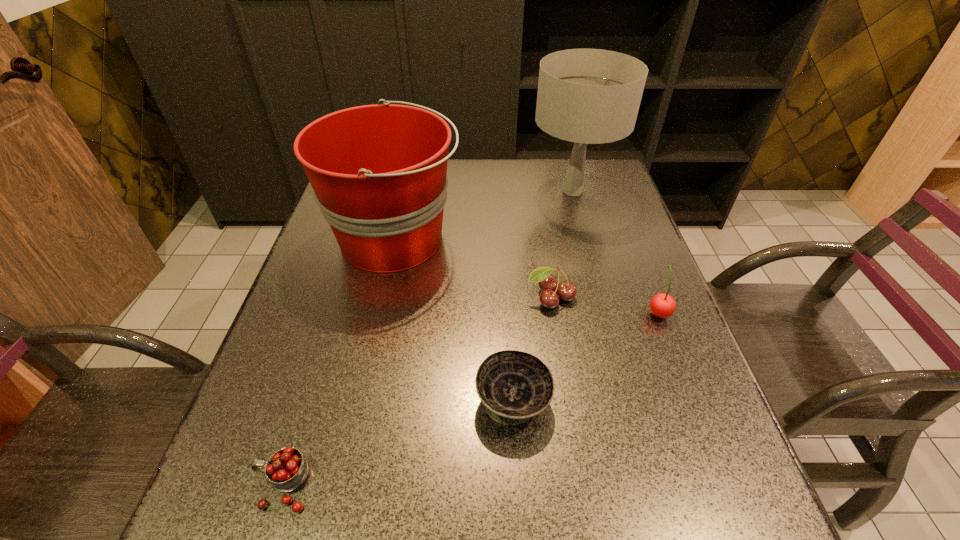
Image resolution: width=960 pixels, height=540 pixels. Identify the location of lampshade located in the right edge section of the desktop. (587, 96).

The image size is (960, 540). I want to click on cherry that is at the right edge, so click(662, 305).

Find the location of a particular element. object present at the near left corner is located at coordinates (286, 469).

Image resolution: width=960 pixels, height=540 pixels. Identify the location of object that is positioned at the far right corner. (587, 96).

In the image, there is a desktop. Identify the location of free space at the far edge. This screenshot has height=540, width=960. (512, 186).

In order to click on vacant area at the left edge in this screenshot , I will do `click(334, 265)`.

This screenshot has height=540, width=960. What are the coordinates of `free space at the right edge of the desktop` in the screenshot? It's located at (680, 343).

Identify the location of vacant space at the near left corner of the desktop. (259, 534).

Identify the location of free location at the far right corner. Image resolution: width=960 pixels, height=540 pixels. (602, 169).

The height and width of the screenshot is (540, 960). What are the coordinates of `free area in between the bucket and the tallest object` in the screenshot? It's located at (484, 215).